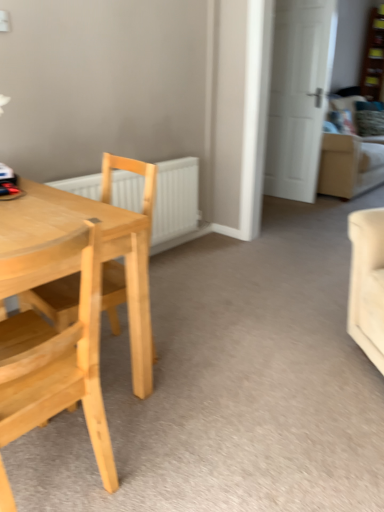
Where is `free space to the right of natural wood chair at left, positioned as the 1th chair in back-to-front order`? This screenshot has height=512, width=384. free space to the right of natural wood chair at left, positioned as the 1th chair in back-to-front order is located at coordinates (203, 362).